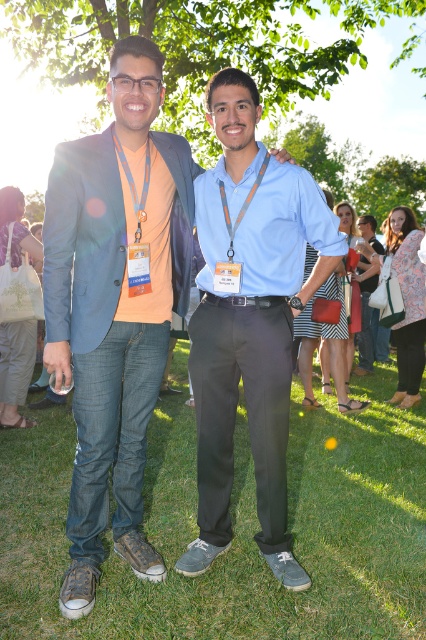
Does matte blue blazer at center appear on the left side of light blue shirt at center?

Yes, matte blue blazer at center is to the left of light blue shirt at center.

Who is lower down, matte blue blazer at center or light blue shirt at center?

Positioned lower is light blue shirt at center.

Where is `matte blue blazer at center`? Image resolution: width=426 pixels, height=640 pixels. matte blue blazer at center is located at coordinates (115, 307).

Is light blue shirt at center bigger than orange fabric lanyard at center?

Yes, light blue shirt at center is bigger than orange fabric lanyard at center.

Between light blue shirt at center and orange fabric lanyard at center, which one appears on the right side from the viewer's perspective?

Positioned to the right is light blue shirt at center.

The image size is (426, 640). I want to click on light blue shirt at center, so click(250, 320).

Which is above, green grass at lower center or blue fabric lanyard at left?

Positioned higher is blue fabric lanyard at left.

Can you confirm if green grass at lower center is positioned above blue fabric lanyard at left?

Incorrect, green grass at lower center is not positioned above blue fabric lanyard at left.

At what (x,y) coordinates should I click in order to perform the action: click on green grass at lower center. Please return your answer as a coordinate pair (x, y). Looking at the image, I should click on (233, 529).

The image size is (426, 640). I want to click on green grass at lower center, so click(x=233, y=529).